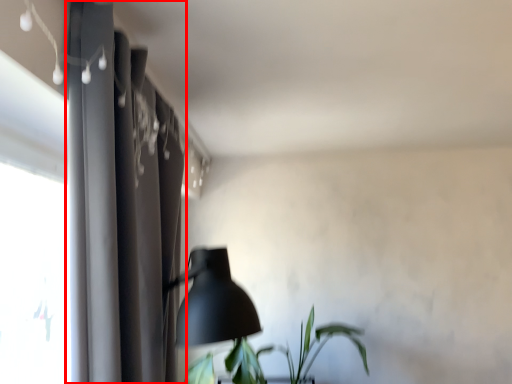
Question: From the image, what is the correct spatial relationship of curtain (annotated by the red box) in relation to houseplant?

Choices:
 (A) left
 (B) right

Answer: (A)